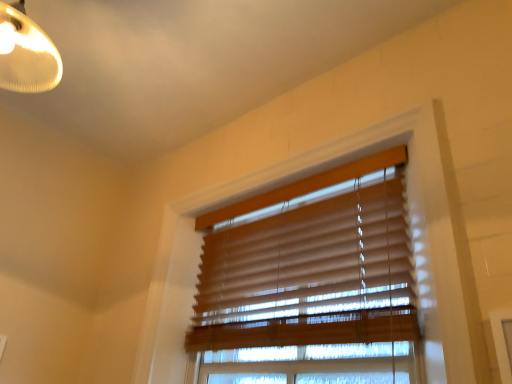
Question: Should I look upward or downward to see wooden blinds at upper center?

Choices:
 (A) down
 (B) up

Answer: (A)